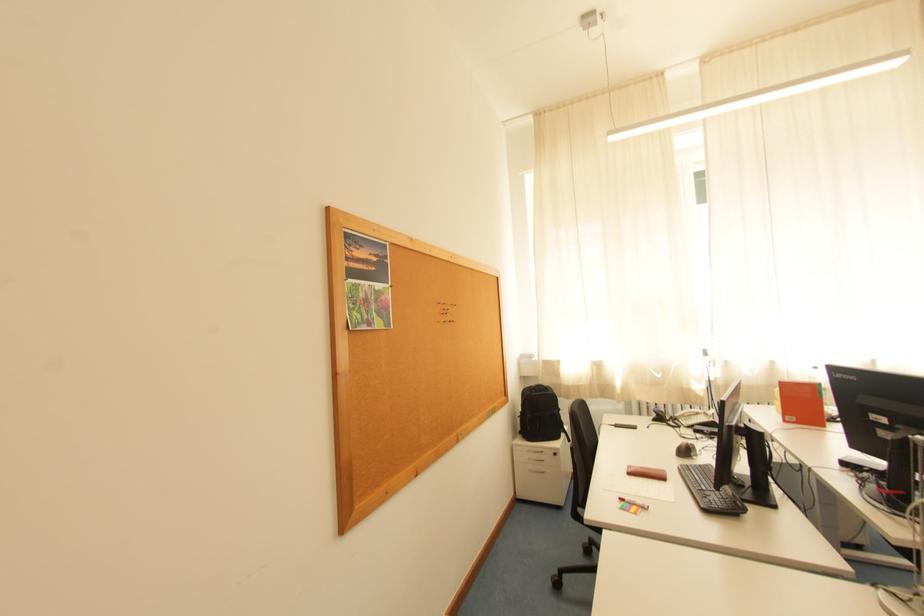
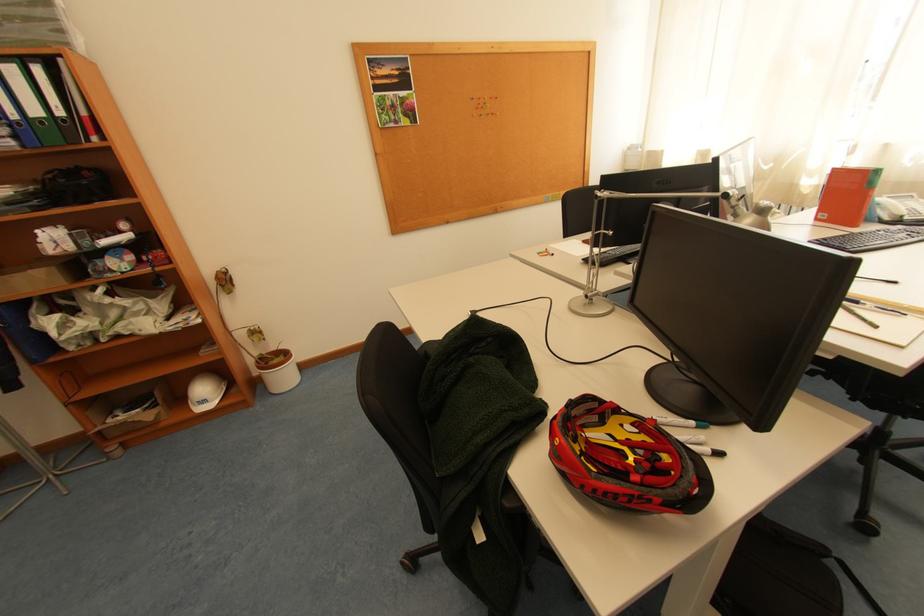
Find the pixel in the second image that matches [794,423] in the first image.

(824, 220)